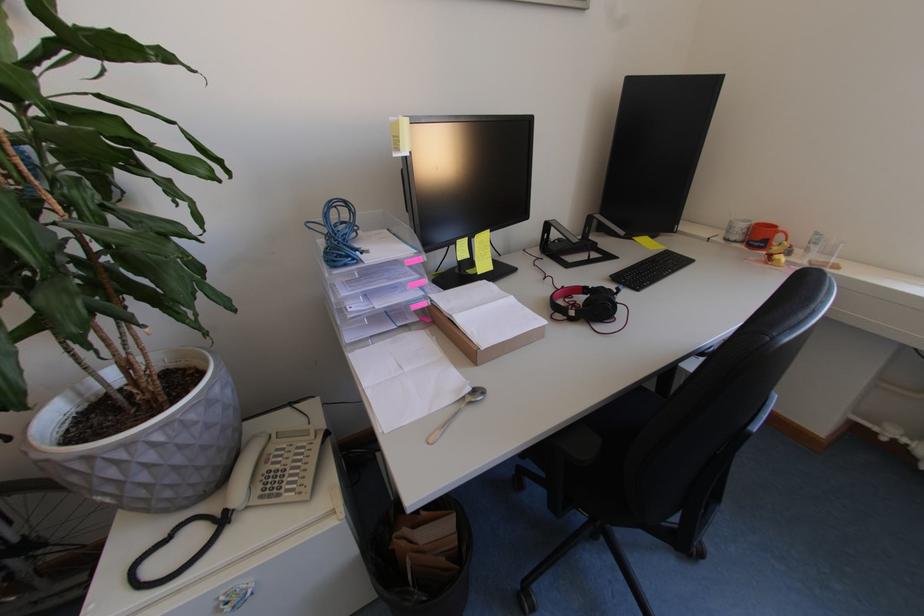
The width and height of the screenshot is (924, 616). Identify the location of small cabinet handle. [235, 598].